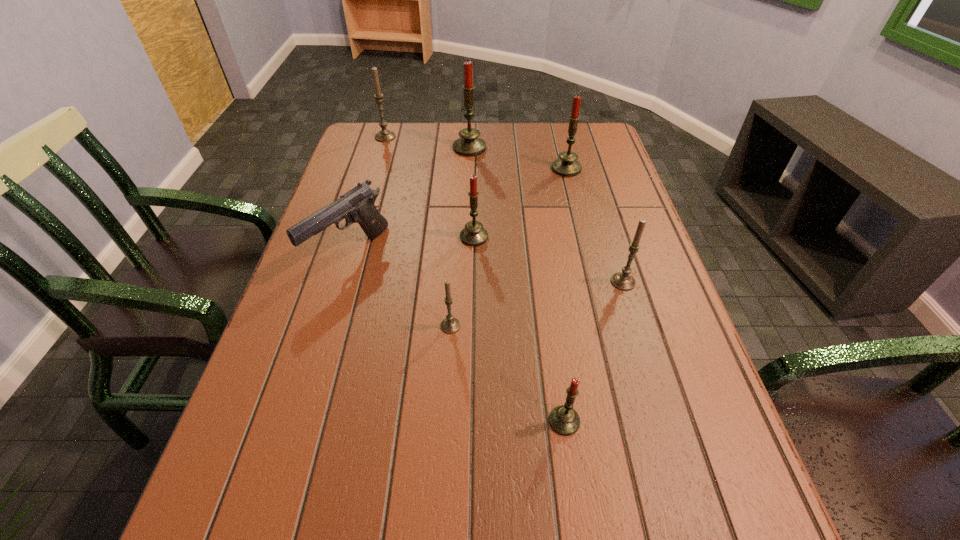
The image size is (960, 540). I want to click on the farthest red candle, so coord(469,144).

Locate an element on the screen. the tallest object is located at coordinates (469, 144).

You are a GUI agent. You are given a task and a screenshot of the screen. Output one action in this format:
    pyautogui.click(x=<x>, y=<y>)
    Task: Click on the second biggest red candle
    This screenshot has height=540, width=960.
    Given the screenshot: What is the action you would take?
    pyautogui.click(x=567, y=166)

Where is `the third farthest object`? the third farthest object is located at coordinates (567, 166).

Where is `the leftmost candle`? the leftmost candle is located at coordinates (384, 135).

This screenshot has width=960, height=540. In order to click on the leftmost gray candle in this screenshot , I will do `click(384, 135)`.

Locate an element on the screen. The width and height of the screenshot is (960, 540). the second smallest red candle is located at coordinates (473, 234).

The height and width of the screenshot is (540, 960). I want to click on the third farthest red candle, so click(473, 234).

The image size is (960, 540). In order to click on the rightmost gray candle in this screenshot , I will do `click(623, 280)`.

The image size is (960, 540). Find the location of `the second biggest gray candle`. the second biggest gray candle is located at coordinates (623, 280).